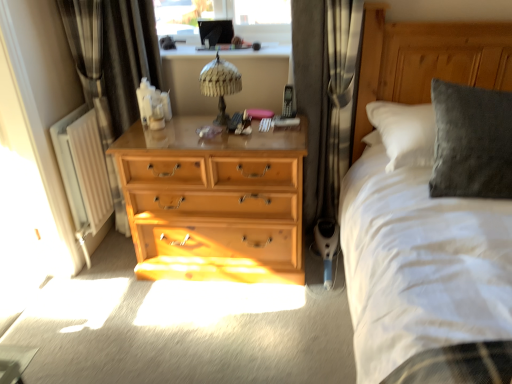
You are a GUI agent. You are given a task and a screenshot of the screen. Output one action in this format:
    pyautogui.click(x=<x>, y=<y>)
    Task: Click on the vacant space in front of black fabric curtain at left, which is the 2th curtain in right-to-left order
    
    Given the screenshot: What is the action you would take?
    pyautogui.click(x=121, y=274)